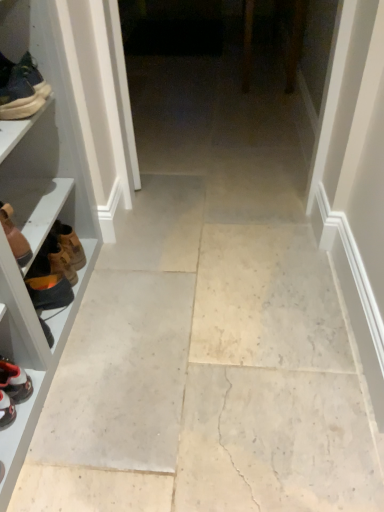
This screenshot has width=384, height=512. Describe the element at coordinates (12, 390) in the screenshot. I see `white leather sneaker at lower left, positioned as the 1th footwear in bottom-to-top order` at that location.

Looking at this image, how much space does white leather sneaker at lower left, which ranks as the 4th footwear in top-to-bottom order, occupy horizontally?

The width of white leather sneaker at lower left, which ranks as the 4th footwear in top-to-bottom order, is 9.45 inches.

Image resolution: width=384 pixels, height=512 pixels. What do you see at coordinates (50, 291) in the screenshot? I see `orange suede boot at left, the third footwear from the top` at bounding box center [50, 291].

The width and height of the screenshot is (384, 512). What do you see at coordinates (56, 268) in the screenshot?
I see `brown leather shoe at left` at bounding box center [56, 268].

At what (x,y) coordinates should I click in order to perform the action: click on white leather sneaker at lower left, which ranks as the 4th footwear in top-to-bottom order. Please return your answer as a coordinate pair (x, y). The height and width of the screenshot is (512, 384). Looking at the image, I should click on [x=12, y=390].

Are matte black sneaker at left, the 4th footwear ordered from the bottom, and orange suede boot at left, the third footwear from the top, far apart?

They are positioned close to each other.

Is matte black sneaker at left, the 4th footwear ordered from the bottom, behind orange suede boot at left, the third footwear from the top?

No, matte black sneaker at left, the 4th footwear ordered from the bottom, is closer to the camera.

From the image's perspective, between matte black sneaker at left, which is counted as the 1th footwear, starting from the top, and orange suede boot at left, which is the second footwear in bottom-to-top order, who is located below?

orange suede boot at left, which is the second footwear in bottom-to-top order, from the image's perspective.

There is a matte black sneaker at left, which is counted as the 1th footwear, starting from the top. Where is `the 2nd footwear below it (from the image's perspective)`? This screenshot has height=512, width=384. the 2nd footwear below it (from the image's perspective) is located at coordinates (50, 291).

Looking at this image, looking at the image, does brown leather boot at left, the second footwear from the top, seem bigger or smaller compared to matte black sneaker at left, the 4th footwear ordered from the bottom?

brown leather boot at left, the second footwear from the top, is smaller than matte black sneaker at left, the 4th footwear ordered from the bottom.

Where is `footwear located above the brown leather boot at left, the second footwear from the top (from the image's perspective)`? The image size is (384, 512). footwear located above the brown leather boot at left, the second footwear from the top (from the image's perspective) is located at coordinates (22, 90).

From a real-world perspective, is brown leather boot at left, the second footwear from the top, on matte black sneaker at left, the 4th footwear ordered from the bottom?

No, from a real-world perspective, brown leather boot at left, the second footwear from the top, is not over matte black sneaker at left, the 4th footwear ordered from the bottom

Is brown leather boot at left, the 3th footwear ordered from the bottom, not near matte black sneaker at left, the 4th footwear ordered from the bottom?

brown leather boot at left, the 3th footwear ordered from the bottom, is actually quite close to matte black sneaker at left, the 4th footwear ordered from the bottom.

From the image's perspective, is matte black sneaker at left, which is counted as the 1th footwear, starting from the top, above or below brown leather shoe at left?

matte black sneaker at left, which is counted as the 1th footwear, starting from the top, is situated higher than brown leather shoe at left in the image.

Is matte black sneaker at left, the 4th footwear ordered from the bottom, next to brown leather shoe at left?

No, matte black sneaker at left, the 4th footwear ordered from the bottom, is not touching brown leather shoe at left.

Considering the positions of points (22, 94) and (48, 300), is point (22, 94) closer to camera compared to point (48, 300)?

Yes.

Consider the image. Is white leather sneaker at lower left, positioned as the 1th footwear in bottom-to-top order, at the back of brown leather boot at left, the 3th footwear ordered from the bottom?

brown leather boot at left, the 3th footwear ordered from the bottom, does not have its back to white leather sneaker at lower left, positioned as the 1th footwear in bottom-to-top order.

Find the location of a particular element. This screenshot has width=384, height=512. footwear that is the 1st object to the right of the white leather sneaker at lower left, positioned as the 1th footwear in bottom-to-top order, starting at the anchor is located at coordinates (15, 236).

Is brown leather boot at left, the second footwear from the top, thinner than white leather sneaker at lower left, positioned as the 1th footwear in bottom-to-top order?

Indeed, brown leather boot at left, the second footwear from the top, has a lesser width compared to white leather sneaker at lower left, positioned as the 1th footwear in bottom-to-top order.

Considering the sizes of objects brown leather boot at left, the second footwear from the top, and white leather sneaker at lower left, positioned as the 1th footwear in bottom-to-top order, in the image provided, who is bigger, brown leather boot at left, the second footwear from the top, or white leather sneaker at lower left, positioned as the 1th footwear in bottom-to-top order,?

brown leather boot at left, the second footwear from the top, is bigger.

What's the angular difference between brown leather boot at left, the 3th footwear ordered from the bottom, and brown leather shoe at left's facing directions?

The angular difference between brown leather boot at left, the 3th footwear ordered from the bottom, and brown leather shoe at left is 1.09 degrees.

Based on the photo, in terms of width, does brown leather boot at left, the 3th footwear ordered from the bottom, look wider or thinner when compared to brown leather shoe at left?

Considering their sizes, brown leather boot at left, the 3th footwear ordered from the bottom, looks broader than brown leather shoe at left.

Which of these two, brown leather boot at left, the 3th footwear ordered from the bottom, or brown leather shoe at left, is smaller?

With smaller size is brown leather shoe at left.

Does brown leather boot at left, the second footwear from the top, turn towards brown leather shoe at left?

No, brown leather boot at left, the second footwear from the top, is not oriented towards brown leather shoe at left.

Is orange suede boot at left, the third footwear from the top, in front of or behind matte black sneaker at left, which is counted as the 1th footwear, starting from the top, in the image?

Visually, orange suede boot at left, the third footwear from the top, is located behind matte black sneaker at left, which is counted as the 1th footwear, starting from the top.

Is point (68, 284) behind point (28, 99)?

Yes, it is.

From the image's perspective, which is above, orange suede boot at left, the third footwear from the top, or matte black sneaker at left, which is counted as the 1th footwear, starting from the top?

matte black sneaker at left, which is counted as the 1th footwear, starting from the top.

From a real-world perspective, is orange suede boot at left, the third footwear from the top, located higher than matte black sneaker at left, which is counted as the 1th footwear, starting from the top?

No.

Between matte black sneaker at left, which is counted as the 1th footwear, starting from the top, and brown leather boot at left, the second footwear from the top, which one has larger size?

With larger size is matte black sneaker at left, which is counted as the 1th footwear, starting from the top.

Considering the sizes of objects matte black sneaker at left, which is counted as the 1th footwear, starting from the top, and brown leather boot at left, the 3th footwear ordered from the bottom, in the image provided, who is wider, matte black sneaker at left, which is counted as the 1th footwear, starting from the top, or brown leather boot at left, the 3th footwear ordered from the bottom,?

brown leather boot at left, the 3th footwear ordered from the bottom.

Is point (40, 83) positioned behind point (7, 205)?

Yes, point (40, 83) is farther from viewer.

Locate an element on the screen. The width and height of the screenshot is (384, 512). footwear that appears behind the matte black sneaker at left, which is counted as the 1th footwear, starting from the top is located at coordinates (50, 291).

What are the coordinates of `the 1st footwear to the left of the matte black sneaker at left, which is counted as the 1th footwear, starting from the top, starting your count from the anchor` in the screenshot? It's located at (15, 236).

Estimate the real-world distances between objects in this image. Which object is closer to brown leather shoe at left, matte black sneaker at left, which is counted as the 1th footwear, starting from the top, or orange suede boot at left, which is the second footwear in bottom-to-top order?

orange suede boot at left, which is the second footwear in bottom-to-top order, is closer to brown leather shoe at left.

When comparing their distances from orange suede boot at left, which is the second footwear in bottom-to-top order, does white leather sneaker at lower left, positioned as the 1th footwear in bottom-to-top order, or brown leather shoe at left seem further?

white leather sneaker at lower left, positioned as the 1th footwear in bottom-to-top order.

Looking at the image, which one is located further to orange suede boot at left, the third footwear from the top, white leather sneaker at lower left, positioned as the 1th footwear in bottom-to-top order, or brown leather boot at left, the second footwear from the top?

The object further to orange suede boot at left, the third footwear from the top, is white leather sneaker at lower left, positioned as the 1th footwear in bottom-to-top order.

Estimate the real-world distances between objects in this image. Which object is closer to brown leather boot at left, the second footwear from the top, matte black sneaker at left, which is counted as the 1th footwear, starting from the top, or brown leather shoe at left?

brown leather shoe at left.

From the image, which object appears to be nearer to orange suede boot at left, the third footwear from the top, white leather sneaker at lower left, which ranks as the 4th footwear in top-to-bottom order, or matte black sneaker at left, which is counted as the 1th footwear, starting from the top?

Among the two, white leather sneaker at lower left, which ranks as the 4th footwear in top-to-bottom order, is located nearer to orange suede boot at left, the third footwear from the top.

From the image, which object appears to be nearer to brown leather shoe at left, orange suede boot at left, which is the second footwear in bottom-to-top order, or matte black sneaker at left, which is counted as the 1th footwear, starting from the top?

orange suede boot at left, which is the second footwear in bottom-to-top order, lies closer to brown leather shoe at left than the other object.

Based on their spatial positions, is brown leather boot at left, the 3th footwear ordered from the bottom, or brown leather shoe at left further from matte black sneaker at left, the 4th footwear ordered from the bottom?

Among the two, brown leather shoe at left is located further to matte black sneaker at left, the 4th footwear ordered from the bottom.

From the image, which object appears to be nearer to white leather sneaker at lower left, which ranks as the 4th footwear in top-to-bottom order, matte black sneaker at left, which is counted as the 1th footwear, starting from the top, or orange suede boot at left, the third footwear from the top?

orange suede boot at left, the third footwear from the top, is closer to white leather sneaker at lower left, which ranks as the 4th footwear in top-to-bottom order.

The height and width of the screenshot is (512, 384). Identify the location of footwear between matte black sneaker at left, which is counted as the 1th footwear, starting from the top, and orange suede boot at left, which is the second footwear in bottom-to-top order, from top to bottom. (15, 236).

This screenshot has height=512, width=384. Identify the location of shoe between matte black sneaker at left, which is counted as the 1th footwear, starting from the top, and orange suede boot at left, which is the second footwear in bottom-to-top order, in the vertical direction. (56, 268).

Image resolution: width=384 pixels, height=512 pixels. I want to click on footwear that lies between brown leather boot at left, the second footwear from the top, and white leather sneaker at lower left, positioned as the 1th footwear in bottom-to-top order, from top to bottom, so click(x=50, y=291).

Locate an element on the screen. The height and width of the screenshot is (512, 384). footwear between matte black sneaker at left, the 4th footwear ordered from the bottom, and brown leather shoe at left in the up-down direction is located at coordinates (15, 236).